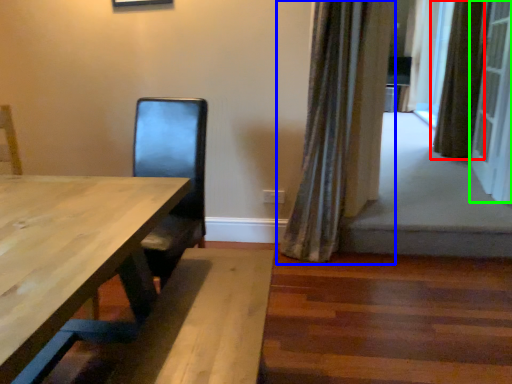
Question: Which object is positioned closest to curtain (highlighted by a red box)? Select from curtain (highlighted by a blue box) and screen door (highlighted by a green box).

Choices:
 (A) curtain
 (B) screen door

Answer: (B)